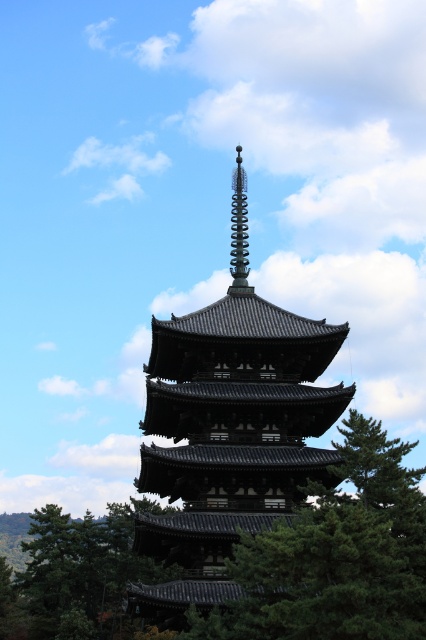
You are standing at the base of the pagoda and notice two points marked on the structure. The first point is located at coordinates point (293, 593) and the second at point (23, 593). Which of these points is closer to you?

Point (293, 593) is in front of point (23, 593), so the first point is closer to you.

You are standing in front of the pagoda and want to take a photo of the spiral metal spire at upper center. To avoid the green textured tree at center blocking the view, which direction should you move?

You should move to the left to position yourself so the spiral metal spire at upper center is no longer blocked by the green textured tree at center, since the tree is currently to the right of the spire.

You are a photographer planning to capture the pagoda with both the green textured tree at center and the green leafy tree at lower left in the frame. Given that you want to ensure both trees are fully visible, which tree should you position closer to the edge of the frame to avoid blocking the pagoda?

You should position the green leafy tree at lower left closer to the edge of the frame because it has a greater width than the green textured tree at center, reducing the risk of it obstructing the pagoda.